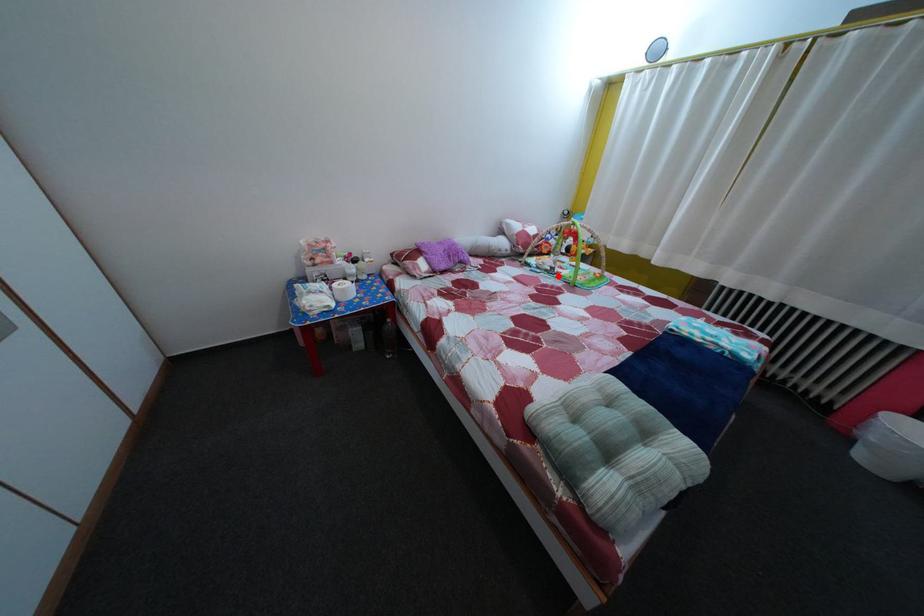
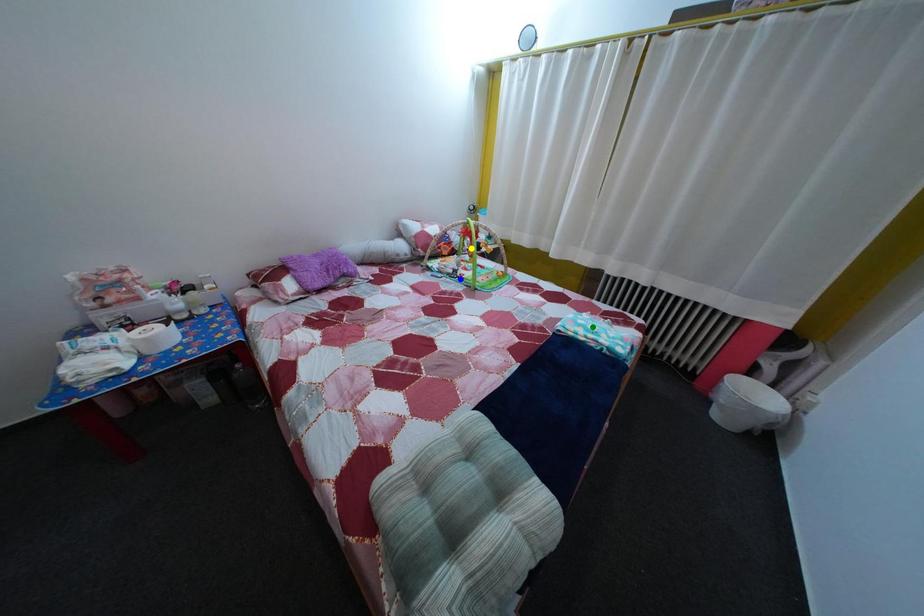
Question: I am providing you with two images of the same scene from different viewpoints. A red point is marked on the first image. You are given multiple points on the second image. Which mark in image 2 goes with the point in image 1?

Choices:
 (A) yellow point
 (B) green point
 (C) blue point

Answer: (C)